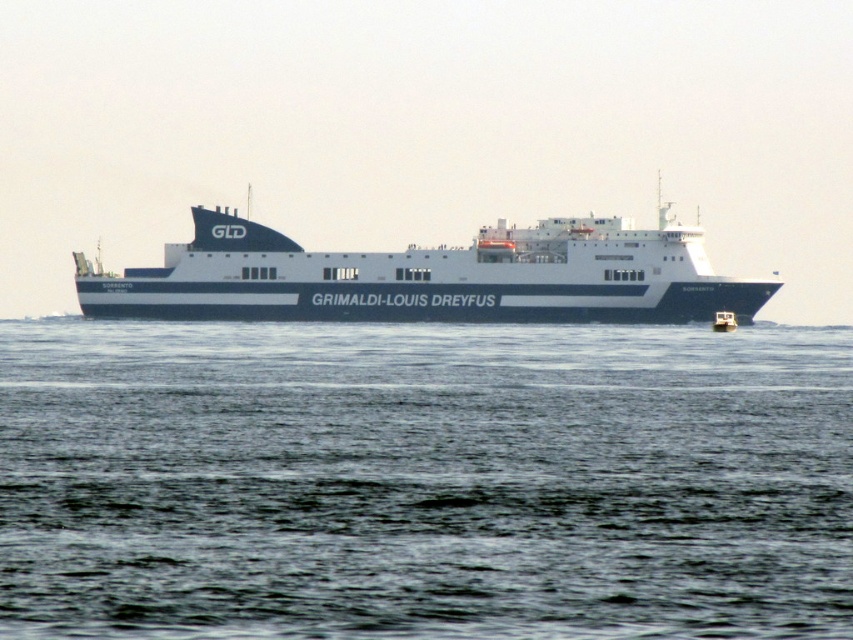
Question: Is blue water at center further to the viewer compared to white matte ferry at center?

Choices:
 (A) yes
 (B) no

Answer: (B)

Question: Can you confirm if blue water at center is thinner than white matte ferry at center?

Choices:
 (A) no
 (B) yes

Answer: (B)

Question: Which point appears closest to the camera in this image?

Choices:
 (A) (485, 241)
 (B) (601, 488)

Answer: (B)

Question: Can you confirm if blue water at center is thinner than white matte ferry at center?

Choices:
 (A) yes
 (B) no

Answer: (A)

Question: Among these objects, which one is nearest to the camera?

Choices:
 (A) blue water at center
 (B) white matte ferry at center

Answer: (A)